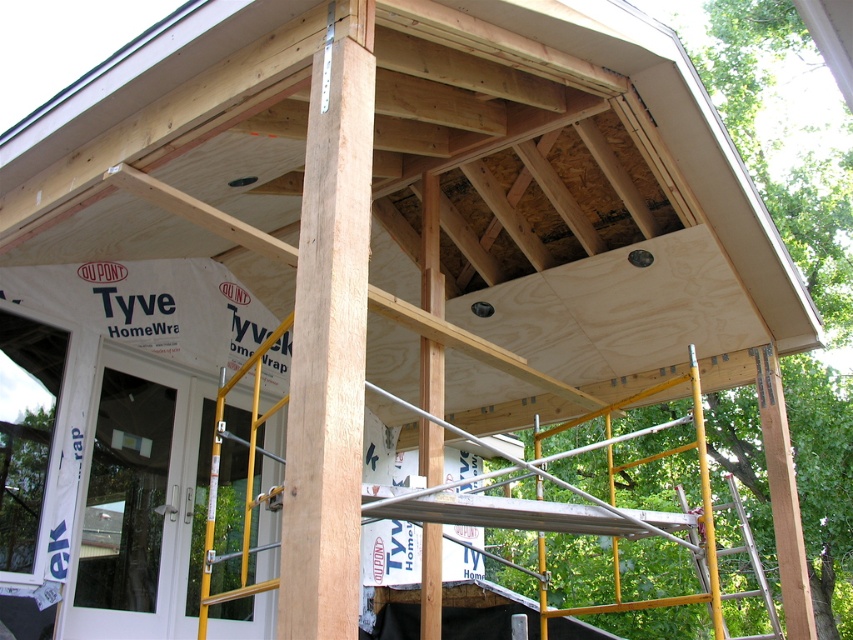
Between natural wood post at center and yellow metal scaffolding at upper center, which one appears on the left side from the viewer's perspective?

From the viewer's perspective, natural wood post at center appears more on the left side.

Describe the element at coordinates (329, 342) in the screenshot. I see `natural wood post at center` at that location.

Between point (345, 488) and point (706, 472), which one is positioned in front?

Point (345, 488) is in front.

At what (x,y) coordinates should I click in order to perform the action: click on natural wood post at center. Please return your answer as a coordinate pair (x, y). This screenshot has height=640, width=853. Looking at the image, I should click on (329, 342).